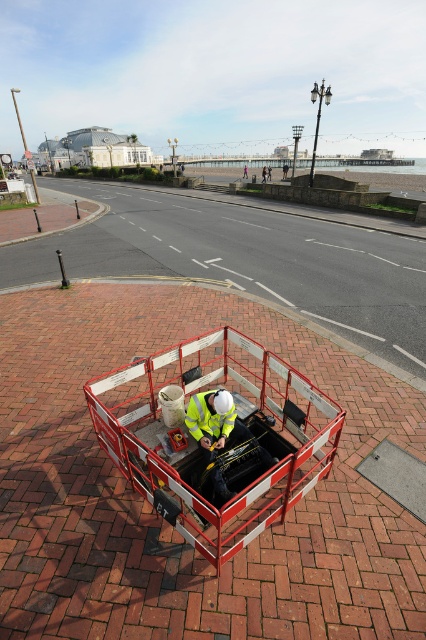
Question: Does reflective yellow vest at center appear under high visibility fabric safety vest at center?

Choices:
 (A) no
 (B) yes

Answer: (A)

Question: Which point is farther to the camera?

Choices:
 (A) reflective yellow vest at center
 (B) metallic red cart at center

Answer: (A)

Question: Is reflective yellow vest at center to the left of metallic red cart at center from the viewer's perspective?

Choices:
 (A) no
 (B) yes

Answer: (B)

Question: Does reflective yellow vest at center appear over high visibility fabric safety vest at center?

Choices:
 (A) no
 (B) yes

Answer: (B)

Question: Which point is farther to the camera?

Choices:
 (A) (184, 516)
 (B) (187, 410)
 (C) (9, 609)

Answer: (B)

Question: Which object is the farthest from the reflective yellow vest at center?

Choices:
 (A) high visibility fabric safety vest at center
 (B) metallic red cart at center

Answer: (A)